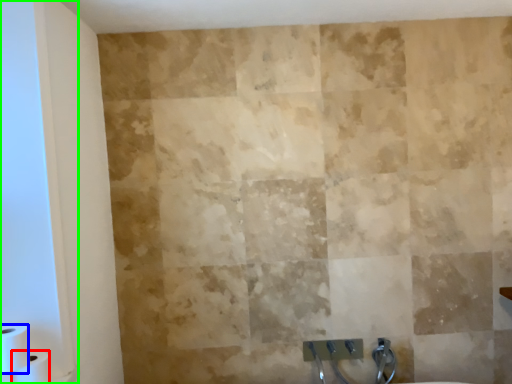
Question: Which is nearer to the toilet paper (highlighted by a red box)? toilet paper (highlighted by a blue box) or glass door (highlighted by a green box).

Choices:
 (A) toilet paper
 (B) glass door

Answer: (A)